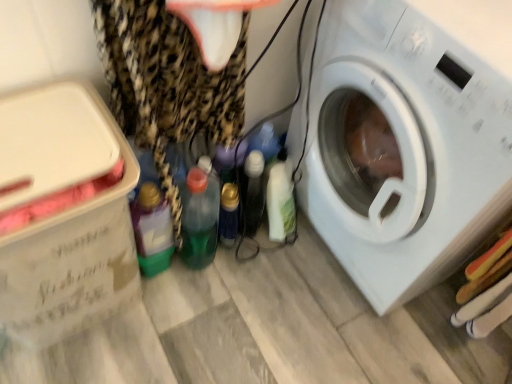
Question: Does translucent plastic bottle at center, marked as the second bottle in a right-to-left arrangement, have a lesser width compared to white plastic washing machine at right?

Choices:
 (A) yes
 (B) no

Answer: (A)

Question: Is translucent plastic bottle at center, which appears as the 3th bottle when viewed from the left, not close to white plastic washing machine at right?

Choices:
 (A) yes
 (B) no

Answer: (B)

Question: From a real-world perspective, is translucent plastic bottle at center, marked as the second bottle in a right-to-left arrangement, beneath white plastic washing machine at right?

Choices:
 (A) no
 (B) yes

Answer: (B)

Question: Considering the relative positions of translucent plastic bottle at center, marked as the second bottle in a right-to-left arrangement, and white plastic washing machine at right in the image provided, is translucent plastic bottle at center, marked as the second bottle in a right-to-left arrangement, to the right of white plastic washing machine at right from the viewer's perspective?

Choices:
 (A) yes
 (B) no

Answer: (B)

Question: Can you confirm if translucent plastic bottle at center, marked as the second bottle in a right-to-left arrangement, is bigger than white plastic washing machine at right?

Choices:
 (A) no
 (B) yes

Answer: (A)

Question: Is point (220, 223) positioned closer to the camera than point (138, 51)?

Choices:
 (A) farther
 (B) closer

Answer: (A)

Question: In the image, is translucent plastic bottle at center, which appears as the 3th bottle when viewed from the left, positioned in front of or behind leopard print fabric at left?

Choices:
 (A) behind
 (B) front

Answer: (A)

Question: From the image's perspective, is translucent plastic bottle at center, which appears as the 3th bottle when viewed from the left, positioned above or below leopard print fabric at left?

Choices:
 (A) below
 (B) above

Answer: (A)

Question: Which is correct: translucent plastic bottle at center, which appears as the 3th bottle when viewed from the left, is inside leopard print fabric at left, or outside of it?

Choices:
 (A) outside
 (B) inside

Answer: (B)

Question: From a real-world perspective, is white cardboard box at left physically located above or below white plastic washing machine at right?

Choices:
 (A) below
 (B) above

Answer: (A)

Question: Based on their sizes in the image, would you say white cardboard box at left is bigger or smaller than white plastic washing machine at right?

Choices:
 (A) big
 (B) small

Answer: (B)

Question: From the image's perspective, is white cardboard box at left positioned above or below white plastic washing machine at right?

Choices:
 (A) above
 (B) below

Answer: (B)

Question: Considering the positions of point (74, 327) and point (435, 107), is point (74, 327) closer or farther from the camera than point (435, 107)?

Choices:
 (A) farther
 (B) closer

Answer: (A)

Question: From their relative heights in the image, would you say white cardboard box at left is taller or shorter than translucent green plastic bottle at lower left, which appears as the 1th bottle when viewed from the left?

Choices:
 (A) tall
 (B) short

Answer: (A)

Question: Is point (31, 215) closer or farther from the camera than point (152, 241)?

Choices:
 (A) closer
 (B) farther

Answer: (A)